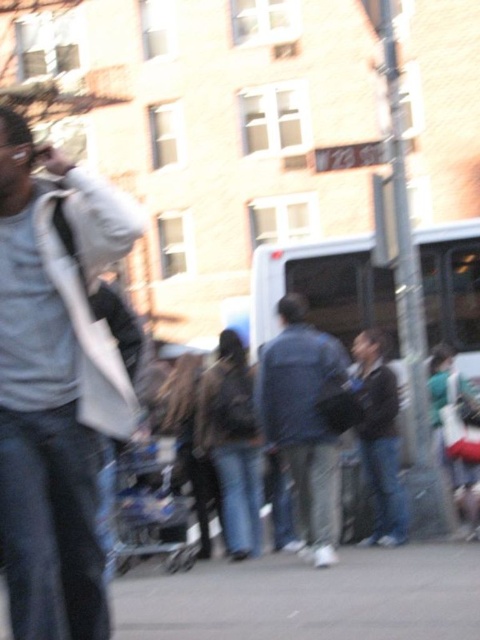
Question: Does gray asphalt pavement at lower center appear on the left side of denim jacket at center?

Choices:
 (A) yes
 (B) no

Answer: (A)

Question: Which point is farther from the camera taking this photo?

Choices:
 (A) (36, 529)
 (B) (299, 424)
 (C) (346, 547)

Answer: (C)

Question: Does white fabric bag at left appear under denim jacket at center?

Choices:
 (A) yes
 (B) no

Answer: (B)

Question: Does white fabric bag at left lie behind denim jacket at center?

Choices:
 (A) yes
 (B) no

Answer: (B)

Question: Which of these objects is positioned closest to the white fabric bag at left?

Choices:
 (A) gray asphalt pavement at lower center
 (B) denim jacket at center

Answer: (A)

Question: Which object is the closest to the denim jacket at center?

Choices:
 (A) white fabric bag at left
 (B) gray asphalt pavement at lower center

Answer: (B)